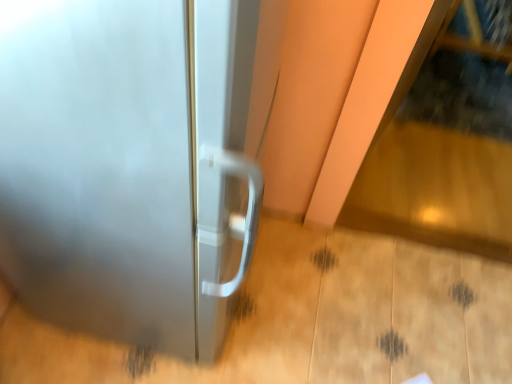
Locate an element on the screen. The width and height of the screenshot is (512, 384). satin silver door at center is located at coordinates (128, 166).

What do you see at coordinates (128, 166) in the screenshot? I see `satin silver door at center` at bounding box center [128, 166].

Locate an element on the screen. The height and width of the screenshot is (384, 512). satin silver door at center is located at coordinates (128, 166).